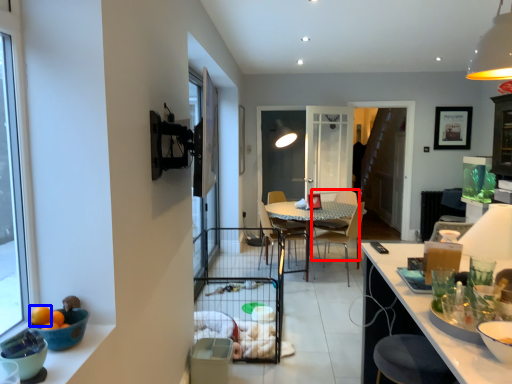
Question: Which point is closer to the camera, armchair (highlighted by a red box) or orange (highlighted by a blue box)?

Choices:
 (A) armchair
 (B) orange

Answer: (B)